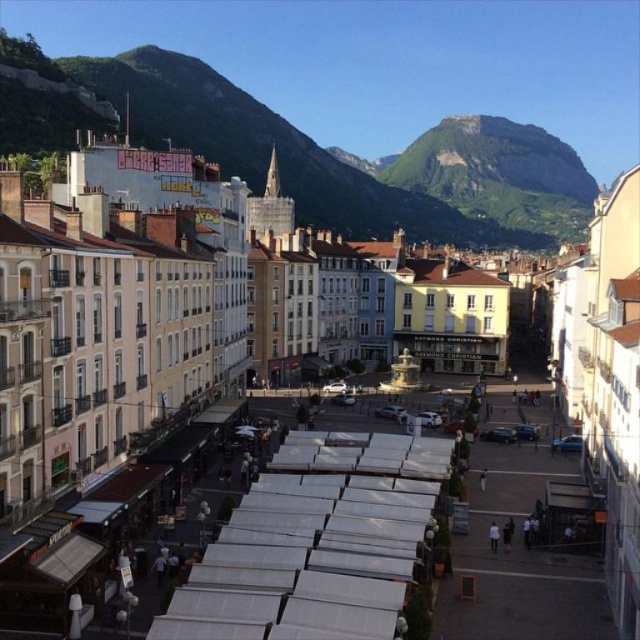
You are an architect planning to build a new observation deck in the mountains. You need to choose between two mountains in the scene. The rocky brown mountain at upper center and the green rock mountain at upper center. Which mountain has a wider base to support a larger structure?

The rocky brown mountain at upper center has a wider base than the green rock mountain at upper center, making it more suitable for supporting a larger structure.

In the urban scene with the market and mountains, which mountain is positioned to the left when looking at the rocky brown mountain at upper center and the green rock mountain at upper center?

The rocky brown mountain at upper center is located to the left of the green rock mountain at upper center.

You are standing in the bustling market area under the white canopies. You want to take a photo of the rocky brown mountain at upper center. Considering the distance, do you think you can capture the entire mountain in a single frame without zooming in?

The rocky brown mountain at upper center is 187.35 meters away from the camera. Since it is relatively far away, you should be able to capture the entire mountain in a single frame without zooming in, assuming your camera has a wide enough angle. However, the exact framing depends on your camera settings and lens capabilities.